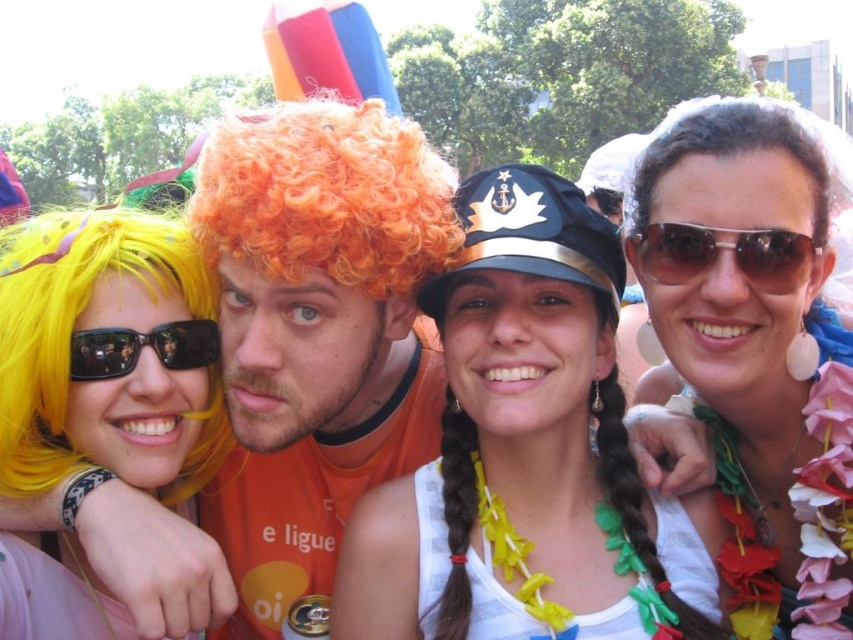
You are standing at the center of the image and want to find the point at coordinates (x=527, y=454). Which object is located at that point?

The point at coordinates (x=527, y=454) is located on the white matte hat at center.

You are a photographer trying to capture a candid shot of the white matte hat at center and the brown reflective sunglasses at upper right. Since you want to avoid glare, which object should you be cautious about due to its reflective surface?

The brown reflective sunglasses at upper right have a reflective surface, so you should be cautious about them to avoid glare.

From the picture: You are a photographer at this event and want to capture a closeup of the pearl necklace at upper right without the brown reflective sunglasses at upper right blocking the view. Can you adjust your angle to do so?

The pearl necklace at upper right is positioned under the brown reflective sunglasses at upper right, so adjusting the angle downward might allow you to capture the pearl necklace at upper right without obstruction.